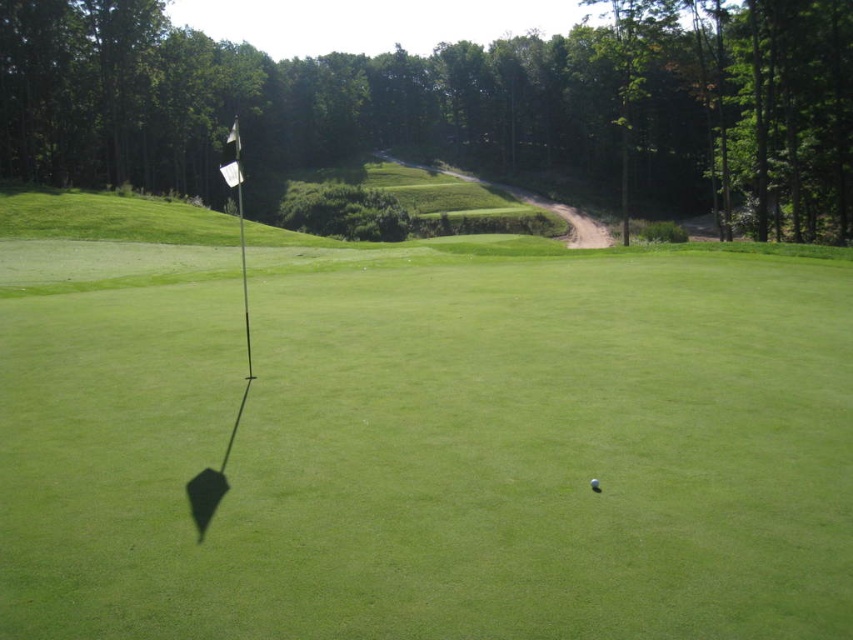
Question: Does green grassy golf course at center have a lesser width compared to white matte golf ball at center?

Choices:
 (A) yes
 (B) no

Answer: (B)

Question: Is green grassy golf course at center closer to camera compared to white matte golf ball at center?

Choices:
 (A) no
 (B) yes

Answer: (B)

Question: Which object appears farthest from the camera in this image?

Choices:
 (A) green grassy golf course at center
 (B) white matte golf ball at center

Answer: (B)

Question: Does green grassy golf course at center appear under white matte golf ball at center?

Choices:
 (A) yes
 (B) no

Answer: (B)

Question: Which of the following is the farthest from the observer?

Choices:
 (A) (769, 340)
 (B) (595, 481)

Answer: (A)

Question: Among these points, which one is farthest from the camera?

Choices:
 (A) (415, 483)
 (B) (595, 480)

Answer: (A)